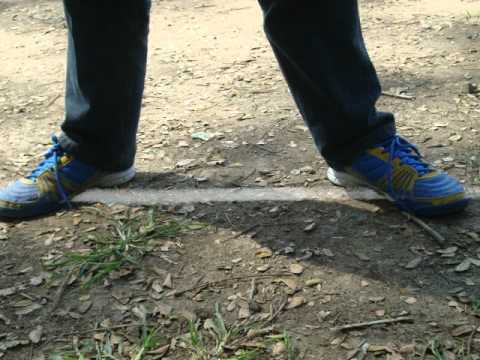
I want to click on light, so click(149, 200), click(291, 190).